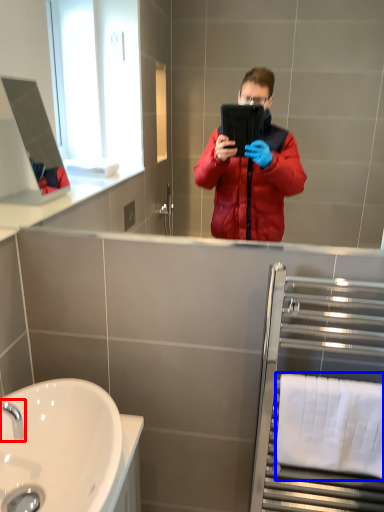
Question: Among these objects, which one is nearest to the camera, tap (highlighted by a red box) or towel bar (highlighted by a blue box)?

Choices:
 (A) tap
 (B) towel bar

Answer: (A)